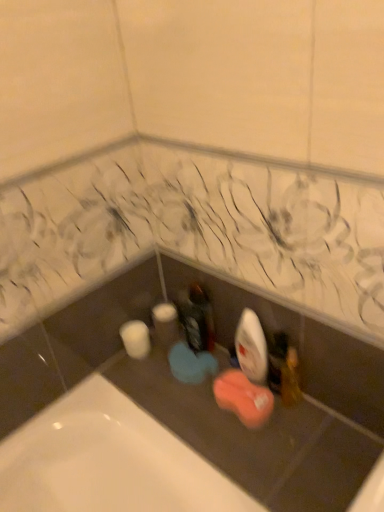
Question: Does wooden toothbrush at lower right come behind matte black bottle at center?

Choices:
 (A) no
 (B) yes

Answer: (A)

Question: Does wooden toothbrush at lower right have a larger size compared to matte black bottle at center?

Choices:
 (A) no
 (B) yes

Answer: (A)

Question: Would you say matte black bottle at center is part of wooden toothbrush at lower right's contents?

Choices:
 (A) yes
 (B) no

Answer: (B)

Question: Is the position of wooden toothbrush at lower right less distant than that of matte black bottle at center?

Choices:
 (A) no
 (B) yes

Answer: (B)

Question: Is wooden toothbrush at lower right to the left of matte black bottle at center from the viewer's perspective?

Choices:
 (A) no
 (B) yes

Answer: (A)

Question: From the image's perspective, is wooden toothbrush at lower right above matte black bottle at center?

Choices:
 (A) yes
 (B) no

Answer: (B)

Question: Considering the relative sizes of white matte toilet paper at lower left and matte black bottle at center in the image provided, is white matte toilet paper at lower left shorter than matte black bottle at center?

Choices:
 (A) no
 (B) yes

Answer: (B)

Question: Considering the relative sizes of white matte toilet paper at lower left and matte black bottle at center in the image provided, is white matte toilet paper at lower left bigger than matte black bottle at center?

Choices:
 (A) yes
 (B) no

Answer: (A)

Question: Can you confirm if white matte toilet paper at lower left is taller than matte black bottle at center?

Choices:
 (A) yes
 (B) no

Answer: (B)

Question: Can you confirm if white matte toilet paper at lower left is wider than matte black bottle at center?

Choices:
 (A) yes
 (B) no

Answer: (A)

Question: Does white matte toilet paper at lower left have a smaller size compared to matte black bottle at center?

Choices:
 (A) yes
 (B) no

Answer: (B)

Question: Would you say white matte toilet paper at lower left contains matte black bottle at center?

Choices:
 (A) no
 (B) yes

Answer: (A)

Question: Are white matte toilet paper at lower left and wooden toothbrush at lower right located far from each other?

Choices:
 (A) no
 (B) yes

Answer: (A)